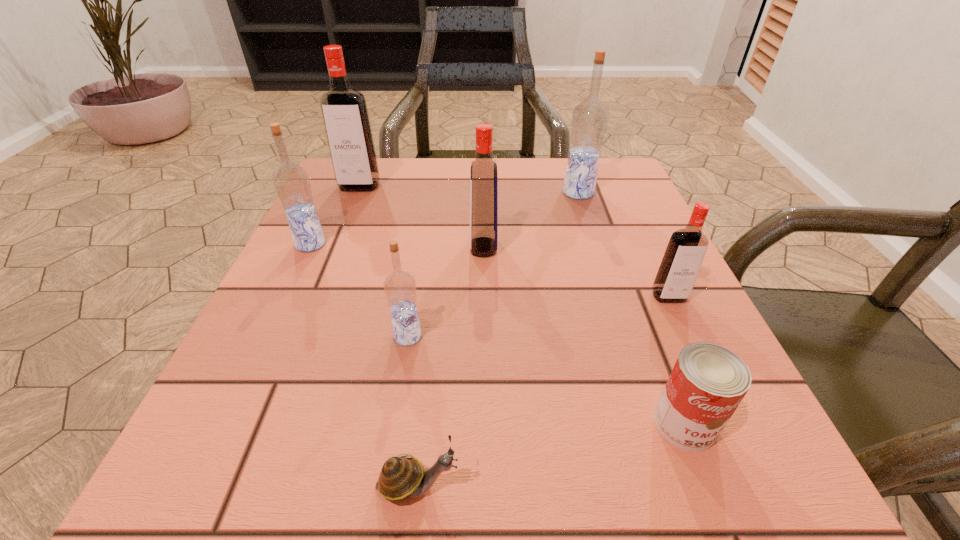
What are the coordinates of `the fifth closest vodka relative to the second vodka from right to left` in the screenshot? It's located at (291, 182).

Locate which blue vodka is the second closest to the rightmost red vodka. Please provide its 2D coordinates. Your answer should be formatted as a tuple, i.e. [(x, y)], where the tuple contains the x and y coordinates of a point satisfying the conditions above.

[(399, 286)]

Identify which blue vodka is the second nearest to the nearest blue vodka. Please provide its 2D coordinates. Your answer should be formatted as a tuple, i.e. [(x, y)], where the tuple contains the x and y coordinates of a point satisfying the conditions above.

[(589, 120)]

Identify the location of the closest red vodka relative to the can. (682, 260).

The image size is (960, 540). In order to click on red vodka identified as the closest to the seventh tallest object in this screenshot , I will do `click(682, 260)`.

This screenshot has height=540, width=960. I want to click on vacant area in the image that satisfies the following two spatial constraints: 1. on the front and back of the farthest red vodka; 2. on the right side of the smallest blue vodka, so click(x=299, y=336).

Identify the location of free spot that satisfies the following two spatial constraints: 1. on the back side of the farthest blue vodka; 2. on the left side of the fourth vodka from right to left. The height and width of the screenshot is (540, 960). (431, 192).

Where is `free spot that satisfies the following two spatial constraints: 1. on the front and back of the nearest blue vodka; 2. on the left side of the biggest red vodka`? free spot that satisfies the following two spatial constraints: 1. on the front and back of the nearest blue vodka; 2. on the left side of the biggest red vodka is located at coordinates (299, 336).

Find the location of a particular element. This screenshot has height=540, width=960. free space that satisfies the following two spatial constraints: 1. on the front and back of the smallest red vodka; 2. on the face of the snail is located at coordinates (757, 485).